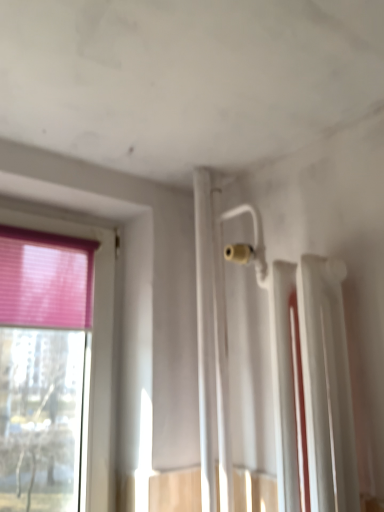
Question: From the image's perspective, does pink fabric curtain at left appear higher than white glossy radiator at upper right?

Choices:
 (A) yes
 (B) no

Answer: (A)

Question: Is pink fabric curtain at left outside of white glossy radiator at upper right?

Choices:
 (A) no
 (B) yes

Answer: (B)

Question: Is pink fabric curtain at left further to camera compared to white glossy radiator at upper right?

Choices:
 (A) yes
 (B) no

Answer: (A)

Question: From a real-world perspective, is pink fabric curtain at left below white glossy radiator at upper right?

Choices:
 (A) no
 (B) yes

Answer: (A)

Question: Is pink fabric curtain at left bigger than white glossy radiator at upper right?

Choices:
 (A) no
 (B) yes

Answer: (A)

Question: Can you confirm if pink fabric curtain at left is smaller than white glossy radiator at upper right?

Choices:
 (A) yes
 (B) no

Answer: (A)

Question: Does white glossy radiator at upper right have a smaller size compared to pink fabric curtain at left?

Choices:
 (A) yes
 (B) no

Answer: (B)

Question: Is white glossy radiator at upper right at the right side of pink fabric curtain at left?

Choices:
 (A) yes
 (B) no

Answer: (A)

Question: From a real-world perspective, is white glossy radiator at upper right positioned under pink fabric curtain at left based on gravity?

Choices:
 (A) no
 (B) yes

Answer: (B)

Question: Is white glossy radiator at upper right located outside pink fabric curtain at left?

Choices:
 (A) yes
 (B) no

Answer: (A)

Question: Does white glossy radiator at upper right come in front of pink fabric curtain at left?

Choices:
 (A) no
 (B) yes

Answer: (B)

Question: From the image's perspective, does white glossy radiator at upper right appear lower than pink fabric curtain at left?

Choices:
 (A) no
 (B) yes

Answer: (B)

Question: Considering the positions of white glossy radiator at upper right and pink fabric curtain at left in the image, is white glossy radiator at upper right bigger or smaller than pink fabric curtain at left?

Choices:
 (A) big
 (B) small

Answer: (A)